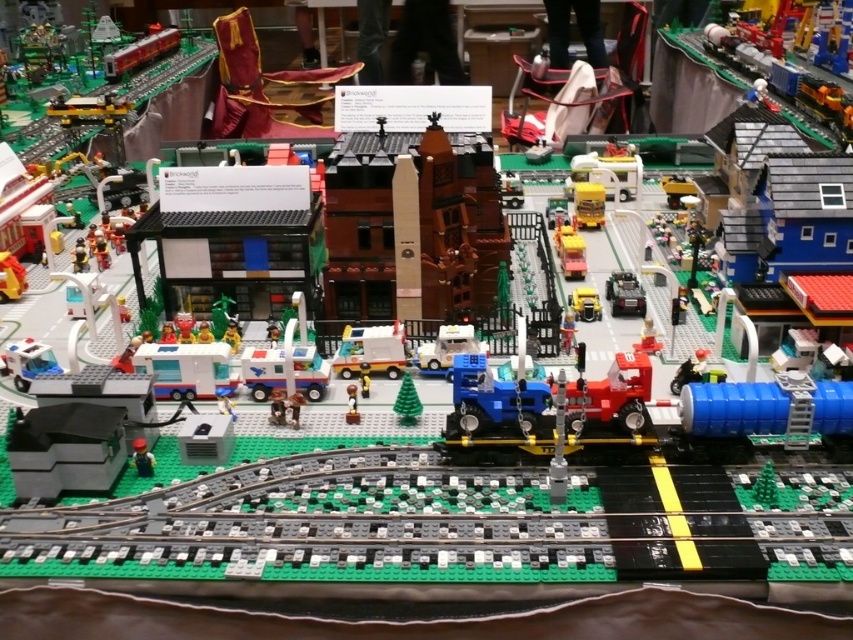
Question: Which point is farther to the camera?

Choices:
 (A) green matte christmas tree at center
 (B) yellow matte truck at center-right

Answer: (B)

Question: Is metallic red train at upper left wider than yellow matte truck at center?

Choices:
 (A) no
 (B) yes

Answer: (B)

Question: Which object is the farthest from the metallic silver truck at center-right?

Choices:
 (A) white plastic ambulance at center
 (B) yellow matte truck at center-right
 (C) green matte christmas tree at center
 (D) green matte figure at lower left

Answer: (D)

Question: Considering the relative positions of green matte christmas tree at center and yellow matte truck at center-right in the image provided, where is green matte christmas tree at center located with respect to yellow matte truck at center-right?

Choices:
 (A) below
 (B) above

Answer: (A)

Question: Is white plastic ambulance at center above metallic silver truck at center-right?

Choices:
 (A) no
 (B) yes

Answer: (A)

Question: Which of the following is the closest to the observer?

Choices:
 (A) (616, 314)
 (B) (581, 212)

Answer: (A)